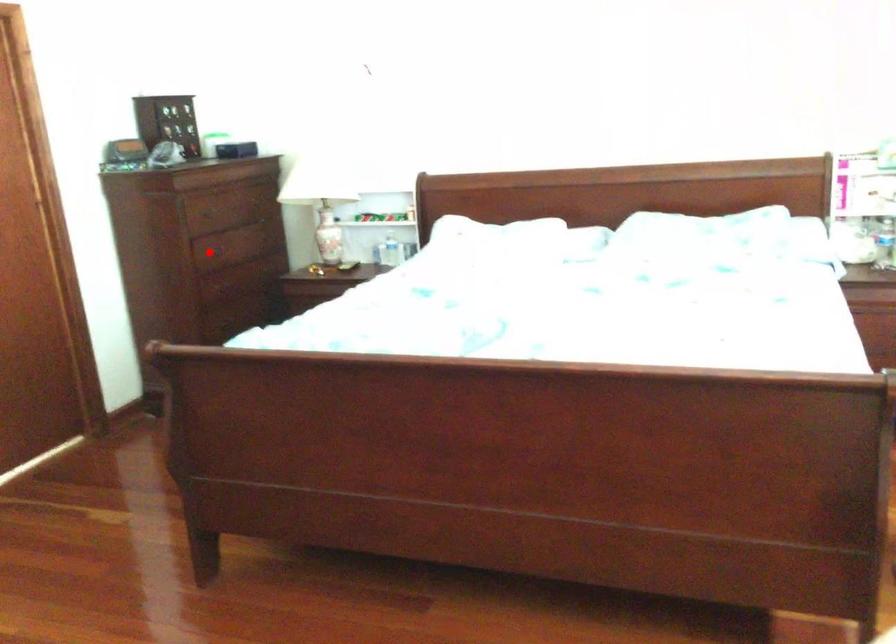
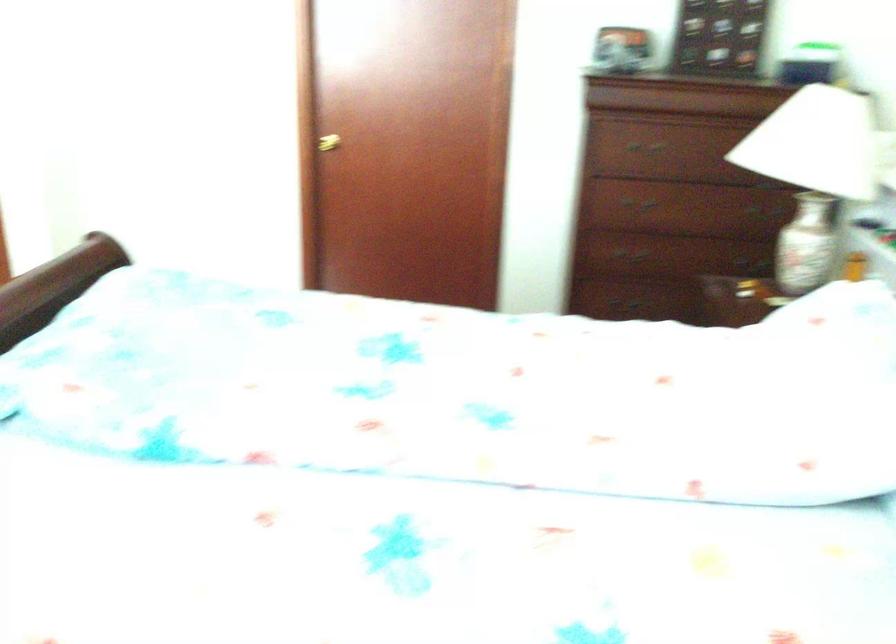
Question: I am providing you with two images of the same scene from different viewpoints. A red point is marked on the first image. At the location where the point appears in image 1, is it still visible in image 2?

Choices:
 (A) Yes
 (B) No

Answer: (B)